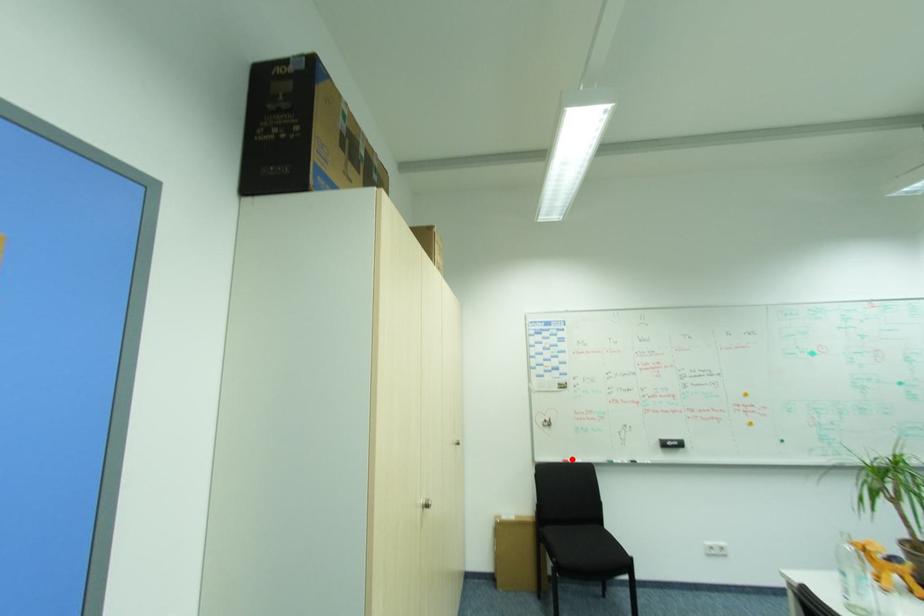
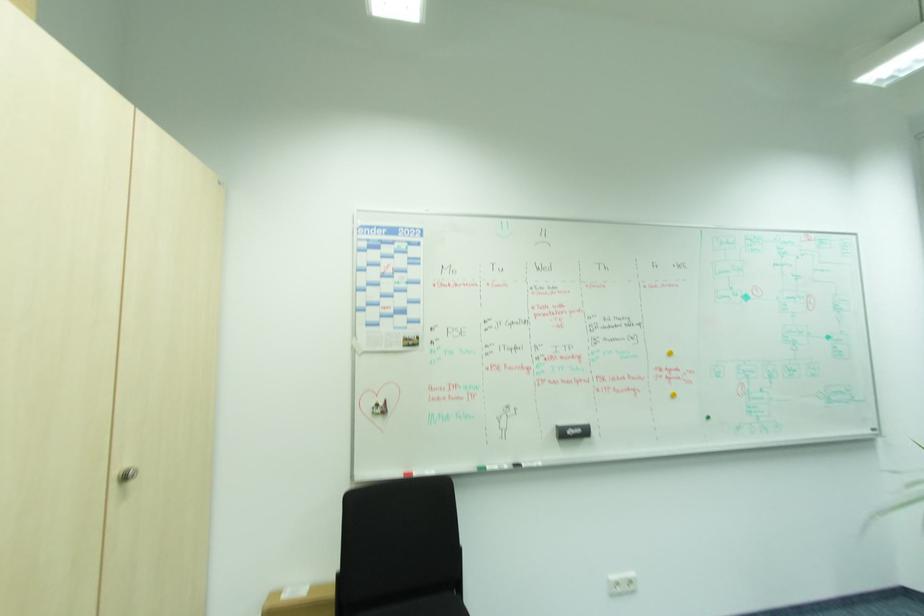
In the second image, find the point that corresponds to the highlighted location in the first image.

(412, 469)